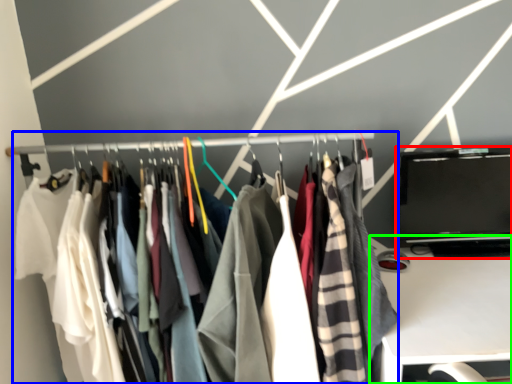
Question: Estimate the real-world distances between objects in this image. Which object is farther from laptop (highlighted by a red box), closet (highlighted by a blue box) or furniture (highlighted by a green box)?

Choices:
 (A) closet
 (B) furniture

Answer: (A)